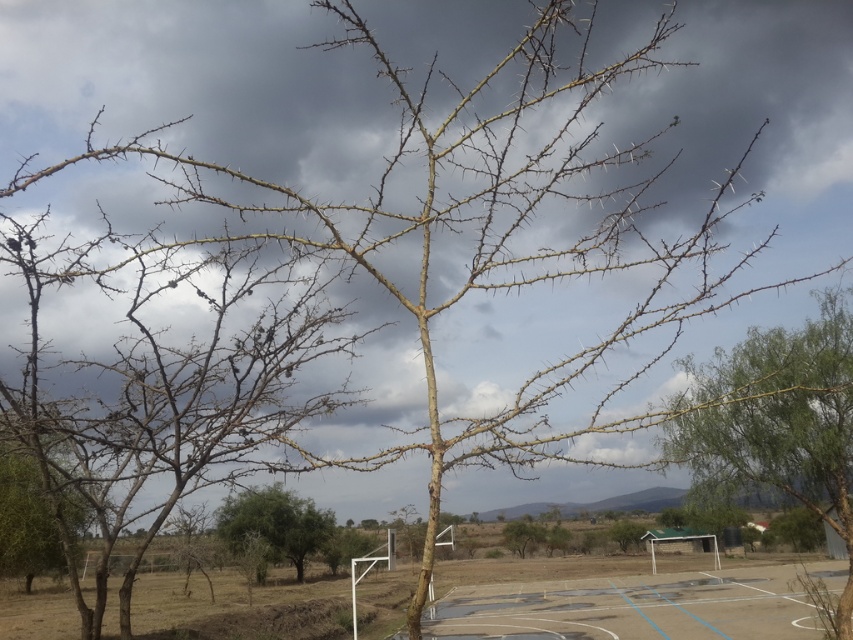
Image resolution: width=853 pixels, height=640 pixels. Describe the element at coordinates (25, 518) in the screenshot. I see `brown thorny tree at lower left` at that location.

Does brown thorny tree at lower left have a lesser height compared to green leafy tree at center?

Incorrect, brown thorny tree at lower left's height does not fall short of green leafy tree at center's.

Find the location of `brown thorny tree at lower left`. brown thorny tree at lower left is located at coordinates (25, 518).

I want to click on brown thorny tree at lower left, so click(25, 518).

Between blue painted concrete basketball court at lower center and brown thorny tree at lower left, which one appears on the right side from the viewer's perspective?

blue painted concrete basketball court at lower center is more to the right.

From the picture: Can you confirm if blue painted concrete basketball court at lower center is positioned to the left of brown thorny tree at lower left?

In fact, blue painted concrete basketball court at lower center is to the right of brown thorny tree at lower left.

Which is behind, point (602, 612) or point (3, 502)?

The point (3, 502) is behind.

What are the coordinates of `blue painted concrete basketball court at lower center` in the screenshot? It's located at (631, 608).

Who is taller, brown thorny branches at center or blue painted concrete basketball court at lower center?

brown thorny branches at center is taller.

Locate an element on the screen. This screenshot has height=640, width=853. brown thorny branches at center is located at coordinates (778, 424).

Locate an element on the screen. This screenshot has height=640, width=853. brown thorny branches at center is located at coordinates (778, 424).